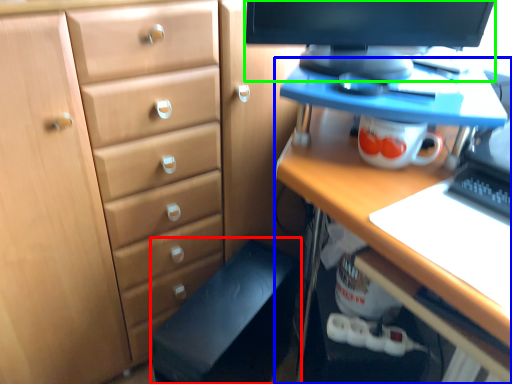
Question: Which object is the closest to the computer chair (highlighted by a red box)? Choose among these: desk (highlighted by a blue box) or computer monitor (highlighted by a green box).

Choices:
 (A) desk
 (B) computer monitor

Answer: (A)